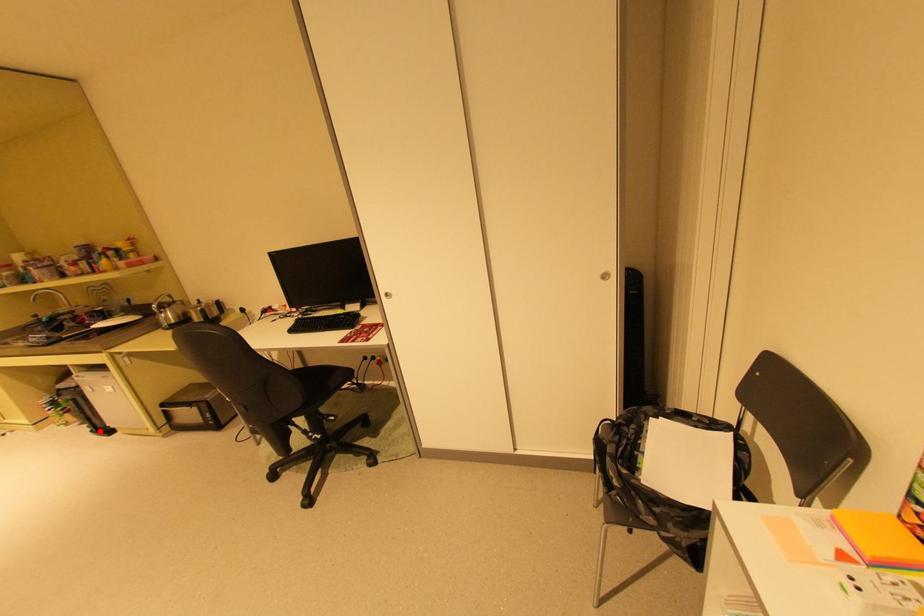
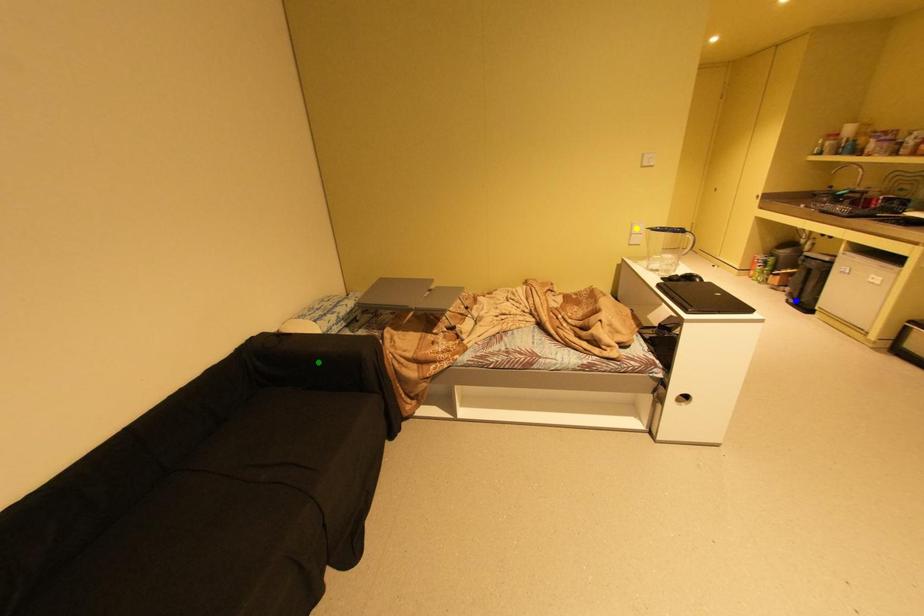
Question: I am providing you with two images of the same scene from different viewpoints. A red point is marked on the first image. You are given multiple points on the second image. Which point in image 2 represents the same 3d spot as the red point in image 1?

Choices:
 (A) yellow point
 (B) green point
 (C) blue point

Answer: (C)